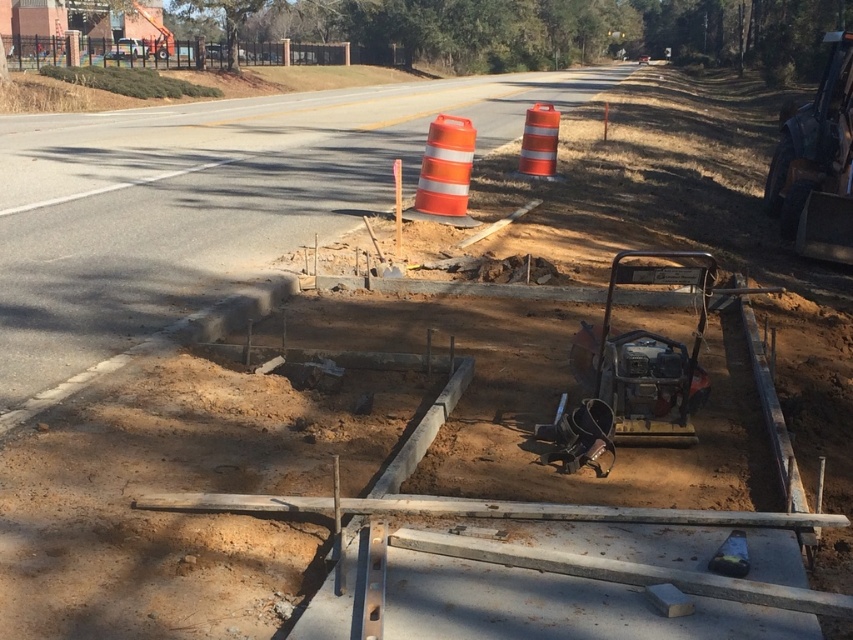
You are a delivery driver approaching the construction site. You need to stop your vehicle at the orange reflective cone at center. What is the exact 2D coordinate where you should stop?

The exact 2D coordinate where you should stop is at point (x=445, y=168).